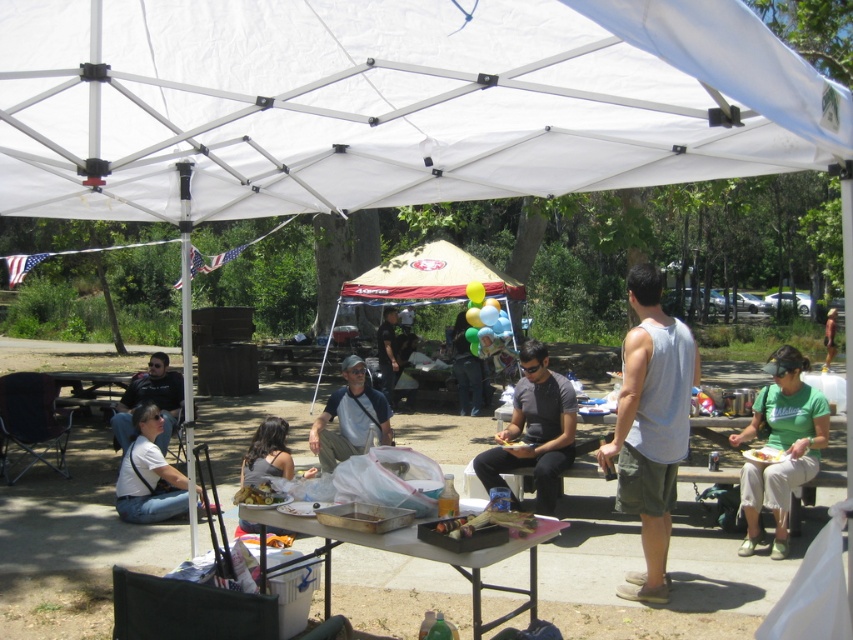
You are organizing a picnic and need to place a metallic silver tray at center and a red fabric tent at center on a table. Based on the scene description, which item should you place first to ensure there is enough space for both?

The metallic silver tray at center might be wider than the red fabric tent at center, so you should place the metallic silver tray at center first to ensure there is enough space for both items.

You are a guest at the picnic and want to know if you can stand under the white fabric canopy at upper center without hitting your head on the matte black jacket at lower left. Can you do that?

The white fabric canopy at upper center is much taller than the matte black jacket at lower left, so you can stand under the white fabric canopy at upper center without hitting your head on the matte black jacket at lower left.